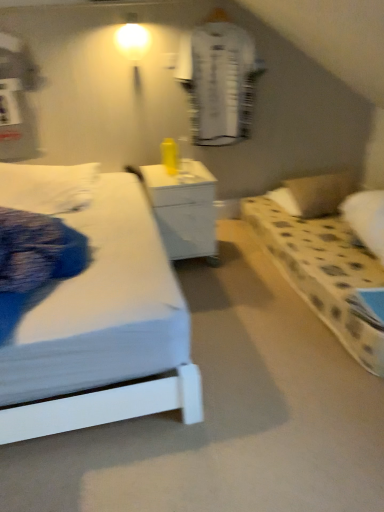
Question: Is white textured robe at upper center taller or shorter than white glossy nightstand at center?

Choices:
 (A) tall
 (B) short

Answer: (A)

Question: In the image, is white textured robe at upper center on the left side or the right side of white glossy nightstand at center?

Choices:
 (A) right
 (B) left

Answer: (A)

Question: Which of these objects is positioned closest to the white textured robe at upper center?

Choices:
 (A) white dotted pillow at right
 (B) matte white bulb at upper center
 (C) white glossy nightstand at center

Answer: (B)

Question: Which object is the closest to the white textured robe at upper center?

Choices:
 (A) matte white bulb at upper center
 (B) white glossy nightstand at center
 (C) white dotted pillow at right

Answer: (A)